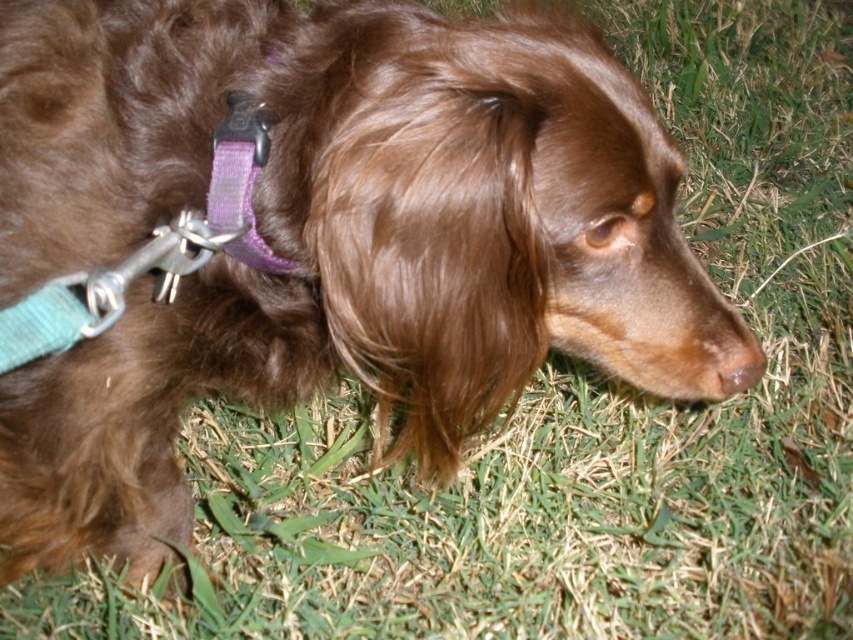
Is purple fabric collar at upper left positioned before brown matte nose at lower center?

Yes, it is.

The width and height of the screenshot is (853, 640). In order to click on purple fabric collar at upper left in this screenshot , I will do `click(241, 182)`.

Which is in front, point (228, 145) or point (727, 371)?

Point (228, 145) is in front.

Locate an element on the screen. Image resolution: width=853 pixels, height=640 pixels. purple fabric collar at upper left is located at coordinates pos(241,182).